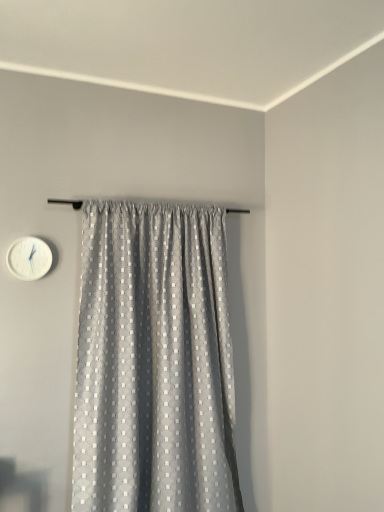
In order to click on gray textured curtain at center in this screenshot , I will do `click(154, 362)`.

This screenshot has height=512, width=384. Describe the element at coordinates (154, 362) in the screenshot. I see `gray textured curtain at center` at that location.

This screenshot has width=384, height=512. What do you see at coordinates (29, 258) in the screenshot? I see `white plastic wall clock at upper left` at bounding box center [29, 258].

What are the coordinates of `white plastic wall clock at upper left` in the screenshot? It's located at (29, 258).

Where is `gray textured curtain at center`? Image resolution: width=384 pixels, height=512 pixels. gray textured curtain at center is located at coordinates (154, 362).

Consider the image. Considering the positions of objects white plastic wall clock at upper left and gray textured curtain at center in the image provided, who is more to the left, white plastic wall clock at upper left or gray textured curtain at center?

From the viewer's perspective, white plastic wall clock at upper left appears more on the left side.

Who is more distant, white plastic wall clock at upper left or gray textured curtain at center?

white plastic wall clock at upper left is further from the camera.

Between point (39, 267) and point (174, 220), which one is positioned behind?

Positioned behind is point (174, 220).

From the image's perspective, which one is positioned lower, white plastic wall clock at upper left or gray textured curtain at center?

gray textured curtain at center.

In the scene shown: From a real-world perspective, between white plastic wall clock at upper left and gray textured curtain at center, who is vertically higher?

From a 3D spatial view, white plastic wall clock at upper left is above.

Looking at this image, which of these two, white plastic wall clock at upper left or gray textured curtain at center, is wider?

gray textured curtain at center.

Is white plastic wall clock at upper left taller than gray textured curtain at center?

In fact, white plastic wall clock at upper left may be shorter than gray textured curtain at center.

Is white plastic wall clock at upper left bigger than gray textured curtain at center?

No.

Could gray textured curtain at center be considered to be inside white plastic wall clock at upper left?

No, gray textured curtain at center is not a part of white plastic wall clock at upper left.

Can you see white plastic wall clock at upper left touching gray textured curtain at center?

No, white plastic wall clock at upper left is not with gray textured curtain at center.

Is white plastic wall clock at upper left facing towards gray textured curtain at center?

No, white plastic wall clock at upper left is not turned towards gray textured curtain at center.

How different are the orientations of white plastic wall clock at upper left and gray textured curtain at center in degrees?

There is a 0.631-degree angle between the facing directions of white plastic wall clock at upper left and gray textured curtain at center.

Find the location of a particular element. wall clock above the gray textured curtain at center (from a real-world perspective) is located at coordinates point(29,258).

Which object is positioned more to the right, gray textured curtain at center or white plastic wall clock at upper left?

gray textured curtain at center is more to the right.

Which is behind, gray textured curtain at center or white plastic wall clock at upper left?

white plastic wall clock at upper left is more distant.

Is point (98, 322) positioned before point (14, 249)?

Yes, it is.

From the image's perspective, which is above, gray textured curtain at center or white plastic wall clock at upper left?

white plastic wall clock at upper left.

From the picture: From a real-world perspective, who is located higher, gray textured curtain at center or white plastic wall clock at upper left?

white plastic wall clock at upper left is physically above.

Considering the relative sizes of gray textured curtain at center and white plastic wall clock at upper left in the image provided, is gray textured curtain at center wider than white plastic wall clock at upper left?

Indeed, gray textured curtain at center has a greater width compared to white plastic wall clock at upper left.

Does gray textured curtain at center have a lesser height compared to white plastic wall clock at upper left?

In fact, gray textured curtain at center may be taller than white plastic wall clock at upper left.

Considering the relative sizes of gray textured curtain at center and white plastic wall clock at upper left in the image provided, is gray textured curtain at center smaller than white plastic wall clock at upper left?

Actually, gray textured curtain at center might be larger than white plastic wall clock at upper left.

Do you think gray textured curtain at center is within white plastic wall clock at upper left, or outside of it?

gray textured curtain at center is not enclosed by white plastic wall clock at upper left.

Are gray textured curtain at center and white plastic wall clock at upper left beside each other?

No, gray textured curtain at center is not next to white plastic wall clock at upper left.

Is gray textured curtain at center oriented towards white plastic wall clock at upper left?

No.

How many degrees apart are the facing directions of gray textured curtain at center and white plastic wall clock at upper left?

The angle between the facing direction of gray textured curtain at center and the facing direction of white plastic wall clock at upper left is 0.631 degrees.

The image size is (384, 512). In order to click on curtain below the white plastic wall clock at upper left (from the image's perspective) in this screenshot , I will do (x=154, y=362).

Where is `wall clock that is on the left side of gray textured curtain at center`? Image resolution: width=384 pixels, height=512 pixels. wall clock that is on the left side of gray textured curtain at center is located at coordinates (29, 258).

You are a GUI agent. You are given a task and a screenshot of the screen. Output one action in this format:
    pyautogui.click(x=<x>, y=<y>)
    Task: Click on the curtain that appears below the white plastic wall clock at upper left (from a real-world perspective)
    This screenshot has height=512, width=384.
    Given the screenshot: What is the action you would take?
    pyautogui.click(x=154, y=362)